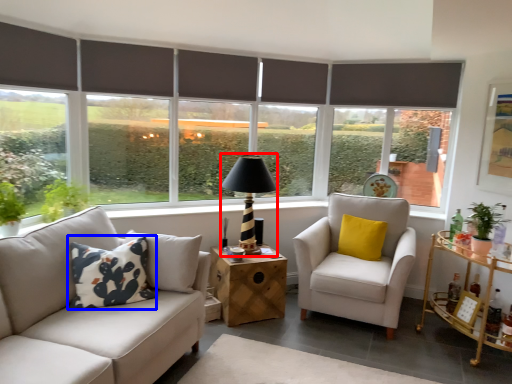
Question: Which object is closer to the camera taking this photo, table lamp (highlighted by a red box) or pillow (highlighted by a blue box)?

Choices:
 (A) table lamp
 (B) pillow

Answer: (B)